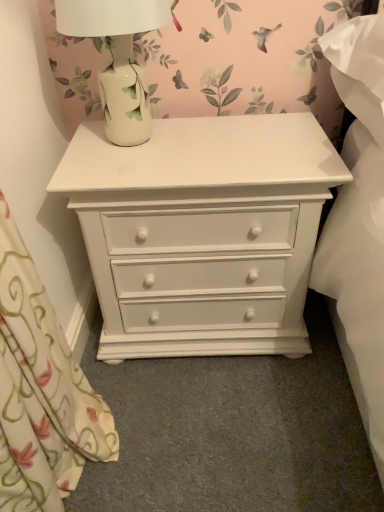
Find the location of a particular element. Image resolution: width=384 pixels, height=512 pixels. blank space above white painted wood chest of drawers at center (from a real-world perspective) is located at coordinates (181, 135).